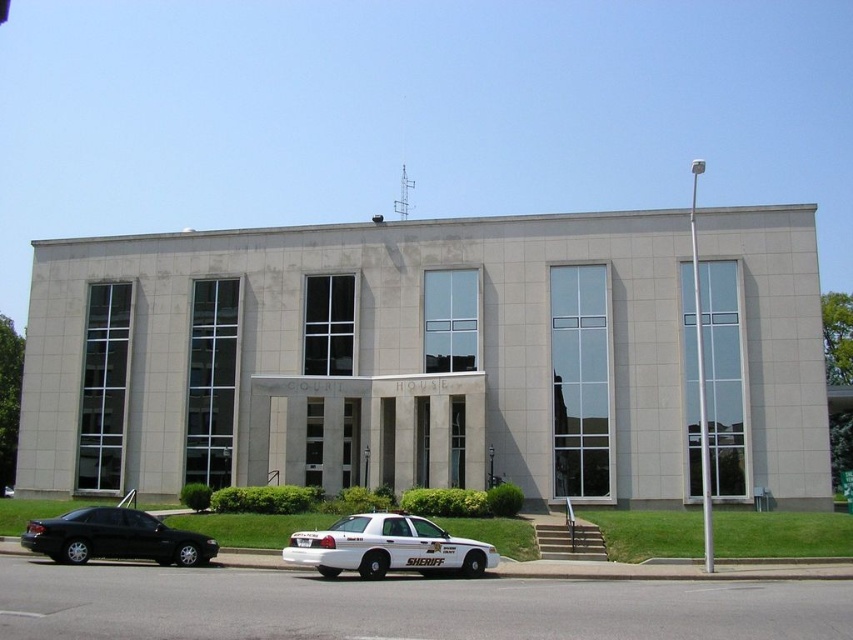
Question: Which object is closer to the camera taking this photo?

Choices:
 (A) white glossy police car at center
 (B) matte black sedan at lower left

Answer: (B)

Question: Is white glossy police car at center above matte black sedan at lower left?

Choices:
 (A) no
 (B) yes

Answer: (B)

Question: Among these objects, which one is farthest from the camera?

Choices:
 (A) matte black sedan at lower left
 (B) white glossy police car at center

Answer: (B)

Question: Is white glossy police car at center to the right of matte black sedan at lower left from the viewer's perspective?

Choices:
 (A) yes
 (B) no

Answer: (A)

Question: Can you confirm if white glossy police car at center is thinner than matte black sedan at lower left?

Choices:
 (A) yes
 (B) no

Answer: (A)